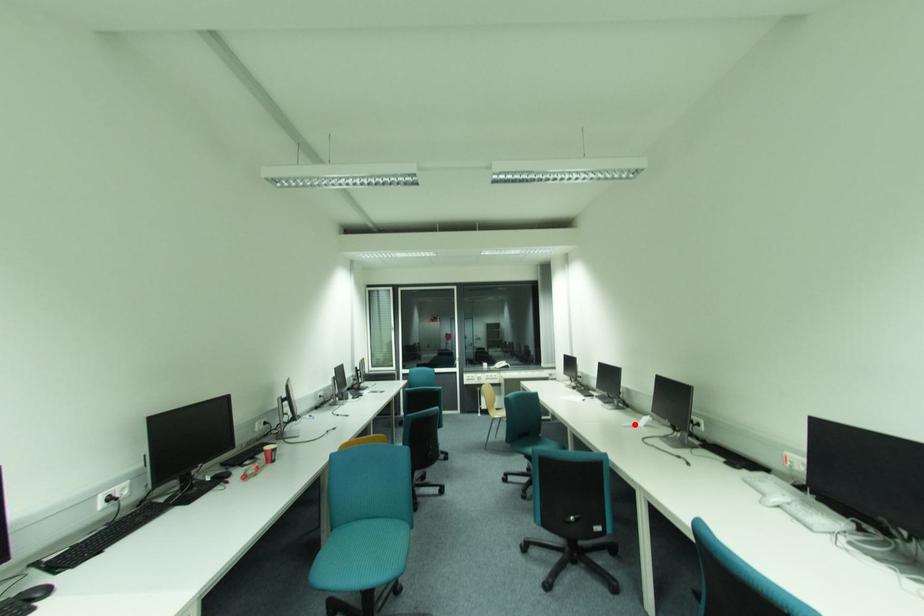
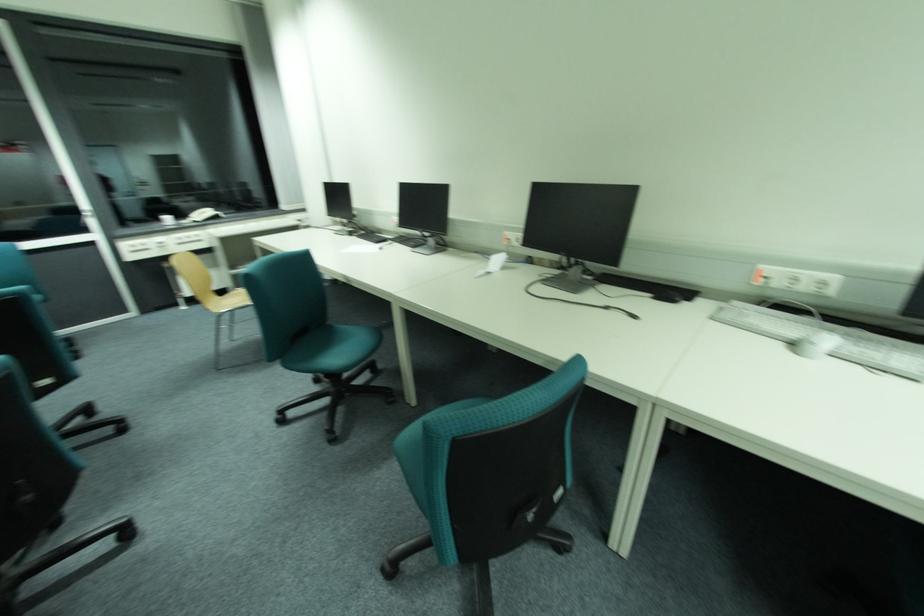
Where in the second image is the point corresponding to the highlighted location from the first image?

(487, 272)